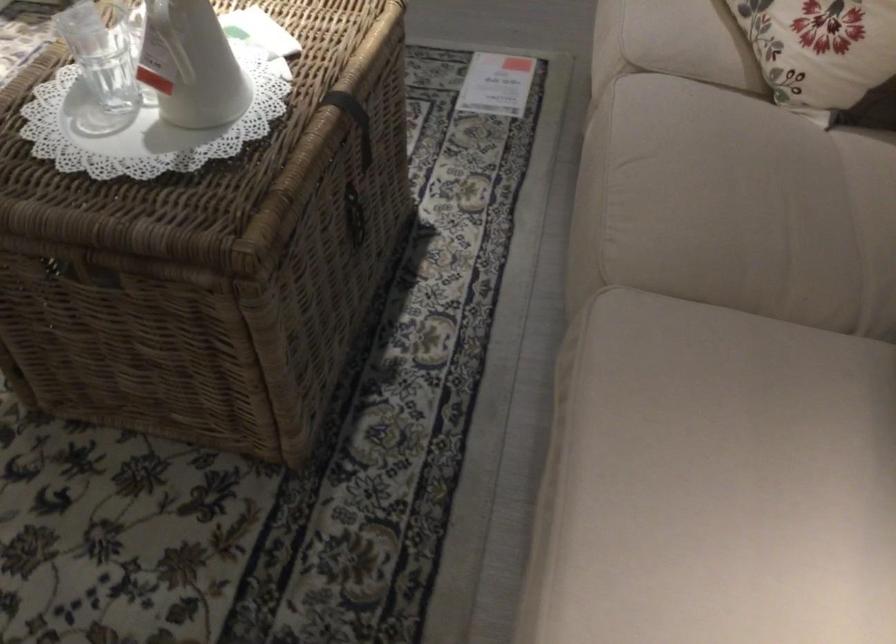
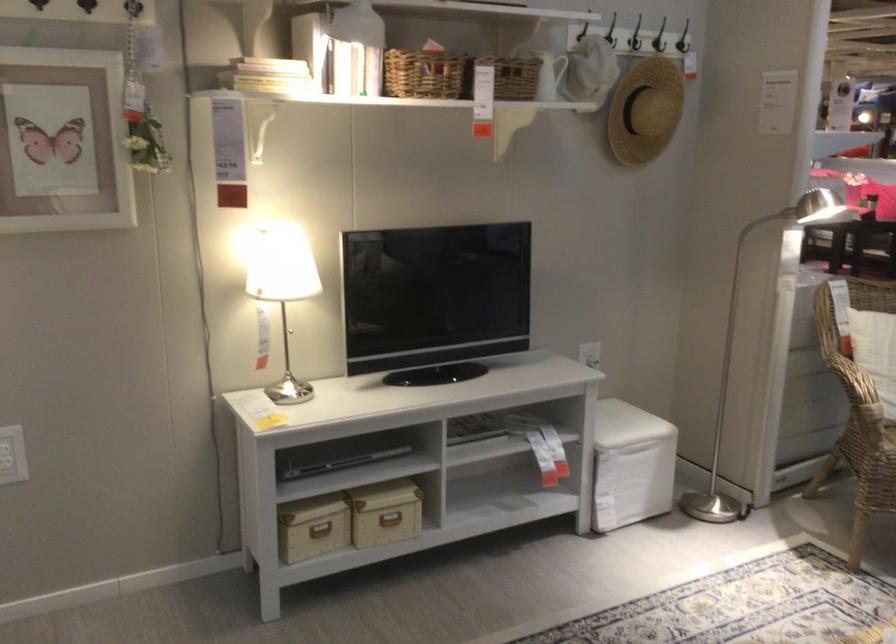
First-person continuous shooting, in which direction is the camera rotating?

The camera rotated toward left-up.